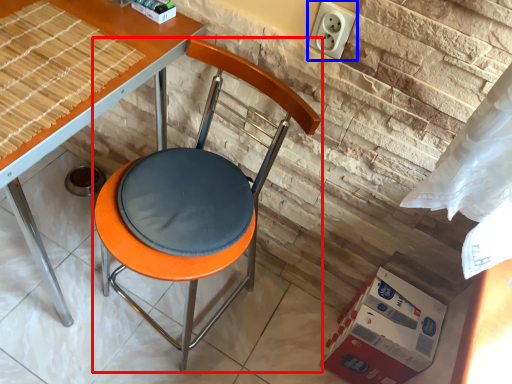
Question: Which point is further to the camera, chair (highlighted by a red box) or electric outlet (highlighted by a blue box)?

Choices:
 (A) chair
 (B) electric outlet

Answer: (B)